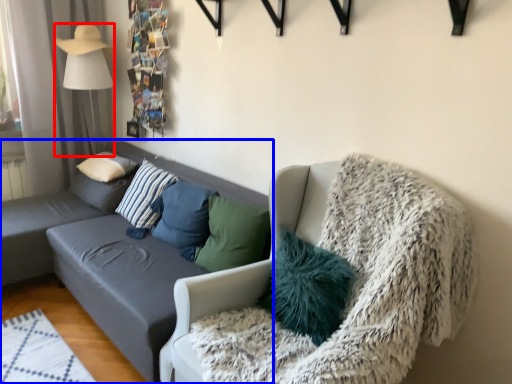
Question: Among these objects, which one is farthest to the camera, lamp (highlighted by a red box) or studio couch (highlighted by a blue box)?

Choices:
 (A) lamp
 (B) studio couch

Answer: (A)